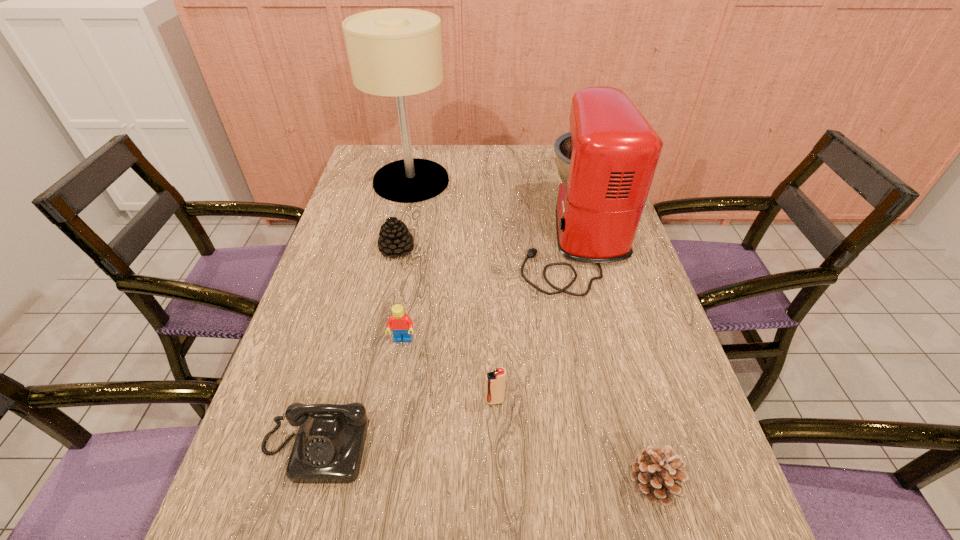
Find the location of a particular element. table lamp is located at coordinates point(397,52).

Image resolution: width=960 pixels, height=540 pixels. I want to click on kitchen mixer, so click(x=607, y=161).

Where is `the fourth nearest object`? the fourth nearest object is located at coordinates (401, 325).

Where is `the left pinecone`? This screenshot has height=540, width=960. the left pinecone is located at coordinates (395, 240).

Identify the location of the third object from right to left. The width and height of the screenshot is (960, 540). (495, 381).

Image resolution: width=960 pixels, height=540 pixels. What are the coordinates of `igniter` in the screenshot? It's located at (495, 381).

The height and width of the screenshot is (540, 960). What are the coordinates of `the nearer pinecone` in the screenshot? It's located at (654, 473).

At what (x,y) coordinates should I click in order to perform the action: click on telephone. Please return your answer as a coordinate pair (x, y). The height and width of the screenshot is (540, 960). Looking at the image, I should click on (328, 449).

This screenshot has height=540, width=960. Identify the location of free space located on the front of the table lamp. (399, 237).

The height and width of the screenshot is (540, 960). Find the location of `vacant space located 0.060m on the front-facing side of the kitchen mixer`. vacant space located 0.060m on the front-facing side of the kitchen mixer is located at coordinates (496, 238).